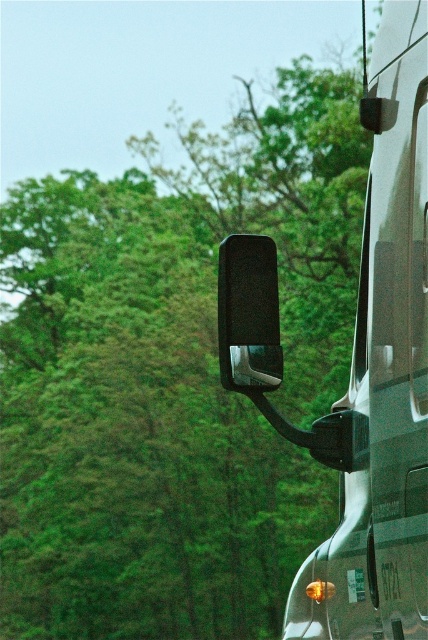
Question: Does metallic silver recreational vehicle at right have a lesser width compared to black matte car mirror at upper right?

Choices:
 (A) no
 (B) yes

Answer: (A)

Question: Which point is closer to the camera?

Choices:
 (A) (272, 257)
 (B) (401, 364)

Answer: (B)

Question: Can you confirm if metallic silver recreational vehicle at right is positioned below black matte car mirror at upper right?

Choices:
 (A) yes
 (B) no

Answer: (A)

Question: Is metallic silver recreational vehicle at right wider than black matte car mirror at upper right?

Choices:
 (A) no
 (B) yes

Answer: (B)

Question: Which point is closer to the camera taking this photo?

Choices:
 (A) (231, 316)
 (B) (318, 566)

Answer: (A)

Question: Which point is farther from the camera taking this photo?

Choices:
 (A) (262, 320)
 (B) (395, 467)

Answer: (A)